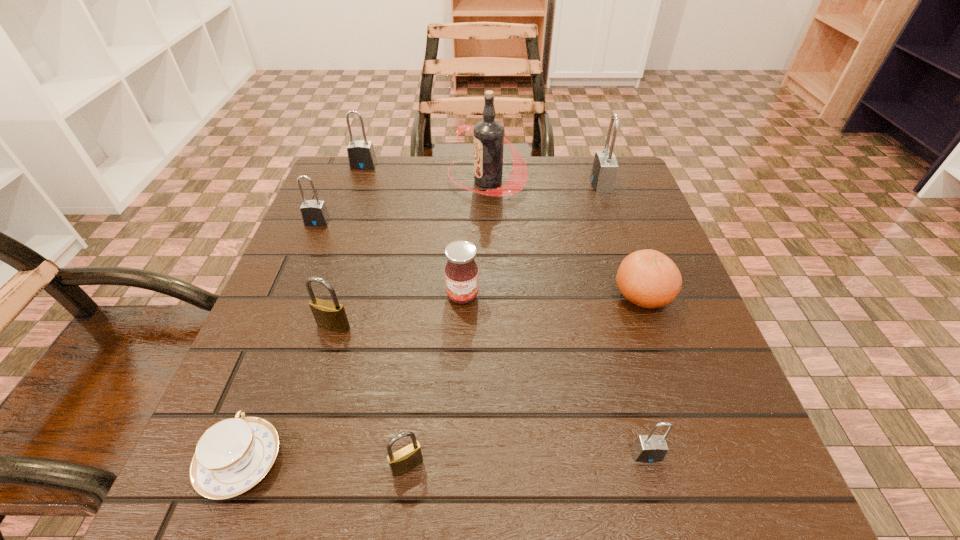
Image resolution: width=960 pixels, height=540 pixels. Find the location of `root beer`. root beer is located at coordinates (488, 134).

The height and width of the screenshot is (540, 960). I want to click on the tallest padlock, so click(x=604, y=170).

Where is `the rightmost gray padlock`? This screenshot has height=540, width=960. the rightmost gray padlock is located at coordinates (604, 170).

Find the location of a particular element. This screenshot has width=960, height=540. the fifth shortest padlock is located at coordinates (361, 155).

Identify the location of the farthest padlock. (361, 155).

This screenshot has width=960, height=540. Find the location of `the third farthest gray padlock`. the third farthest gray padlock is located at coordinates (314, 213).

The image size is (960, 540). I want to click on the fourth nearest padlock, so click(x=314, y=213).

Identify the location of the left brass padlock. (329, 315).

Locate an element on the screen. the fourth nearest object is located at coordinates (329, 315).

Locate an element on the screen. This screenshot has width=960, height=540. jam is located at coordinates (461, 271).